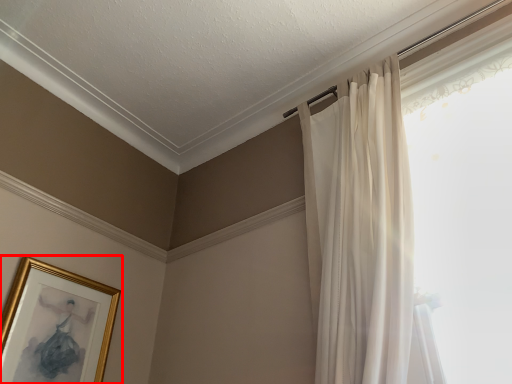
Question: From the image, what is the correct spatial relationship of picture frame (annotated by the red box) in relation to curtain?

Choices:
 (A) right
 (B) left

Answer: (B)